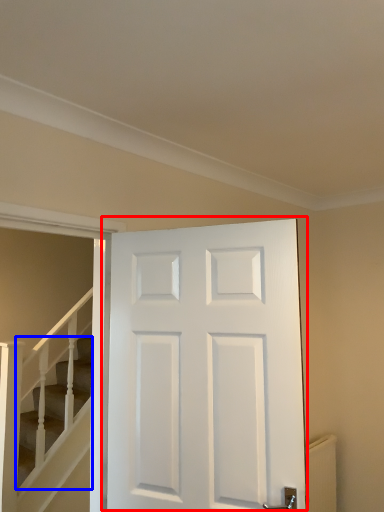
Question: Which object appears farthest to the camera in this image, door (highlighted by a red box) or stairs (highlighted by a blue box)?

Choices:
 (A) door
 (B) stairs

Answer: (B)